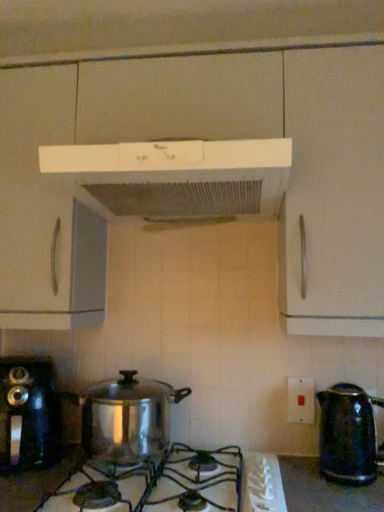
Question: From a real-world perspective, is shiny black kettle at right positioned over white matte range hood at upper center based on gravity?

Choices:
 (A) yes
 (B) no

Answer: (B)

Question: Does shiny black kettle at right have a greater width compared to white matte range hood at upper center?

Choices:
 (A) yes
 (B) no

Answer: (B)

Question: Is shiny black kettle at right aimed at white matte range hood at upper center?

Choices:
 (A) no
 (B) yes

Answer: (A)

Question: Is shiny black kettle at right looking in the opposite direction of white matte range hood at upper center?

Choices:
 (A) yes
 (B) no

Answer: (B)

Question: Is white matte range hood at upper center inside shiny black kettle at right?

Choices:
 (A) no
 (B) yes

Answer: (A)

Question: In terms of width, does shiny black coffee maker at left look wider or thinner when compared to shiny metallic gas stove at center?

Choices:
 (A) wide
 (B) thin

Answer: (B)

Question: Considering their positions, is shiny black coffee maker at left located in front of or behind shiny metallic gas stove at center?

Choices:
 (A) front
 (B) behind

Answer: (B)

Question: Is shiny black coffee maker at left to the left or to the right of shiny metallic gas stove at center in the image?

Choices:
 (A) left
 (B) right

Answer: (A)

Question: Do you think shiny black coffee maker at left is within shiny metallic gas stove at center, or outside of it?

Choices:
 (A) outside
 (B) inside

Answer: (A)

Question: Is white plastic switch at center-right to the left or to the right of shiny black kettle at right in the image?

Choices:
 (A) left
 (B) right

Answer: (A)

Question: In the image, is white plastic switch at center-right positioned in front of or behind shiny black kettle at right?

Choices:
 (A) front
 (B) behind

Answer: (B)

Question: In terms of width, does white plastic switch at center-right look wider or thinner when compared to shiny black kettle at right?

Choices:
 (A) wide
 (B) thin

Answer: (B)

Question: From a real-world perspective, is white plastic switch at center-right above or below shiny black kettle at right?

Choices:
 (A) below
 (B) above

Answer: (B)

Question: Based on their sizes in the image, would you say white matte range hood at upper center is bigger or smaller than stainless steel pot at center?

Choices:
 (A) small
 (B) big

Answer: (B)

Question: From the image's perspective, is white matte range hood at upper center positioned above or below stainless steel pot at center?

Choices:
 (A) above
 (B) below

Answer: (A)